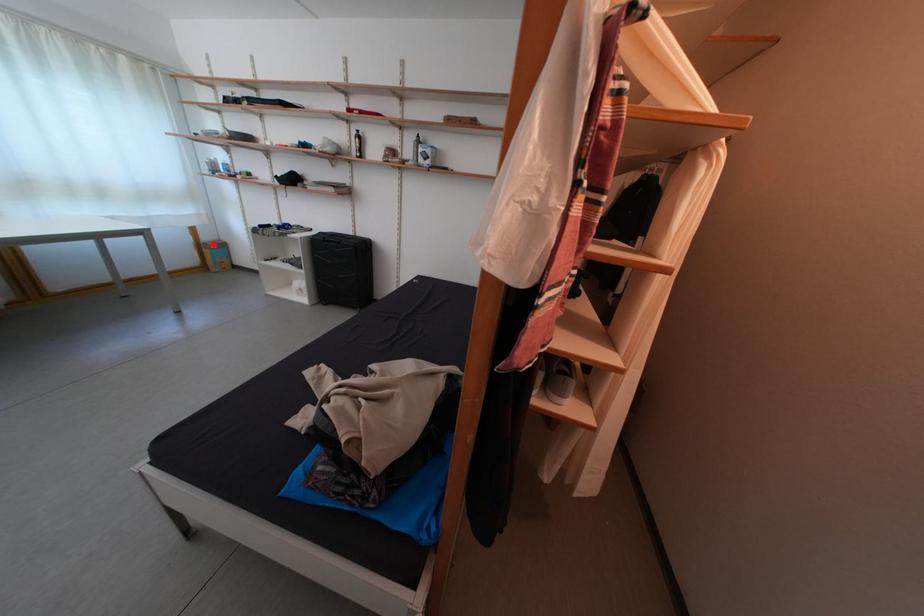
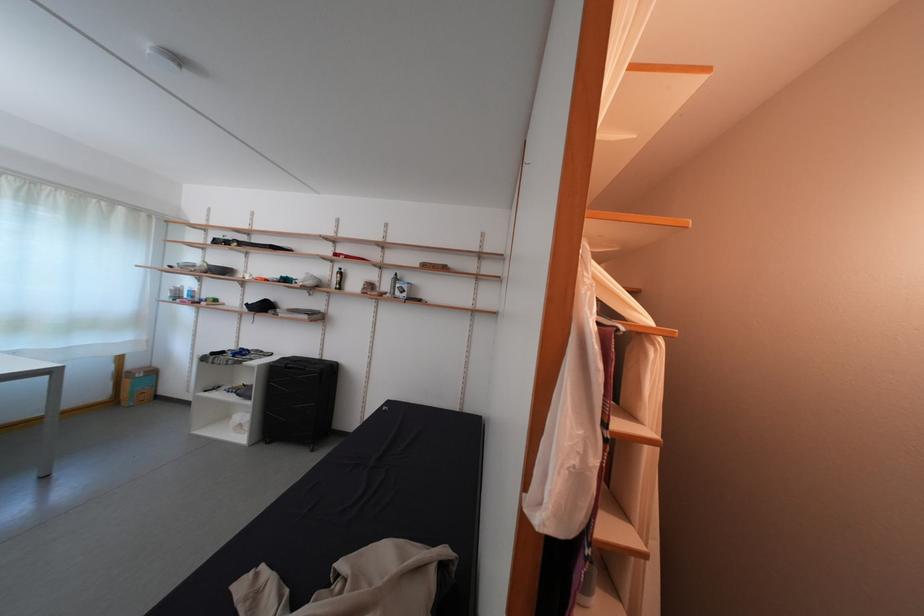
The point at the highlighted location is marked in the first image. Where is the corresponding point in the second image?

(140, 371)